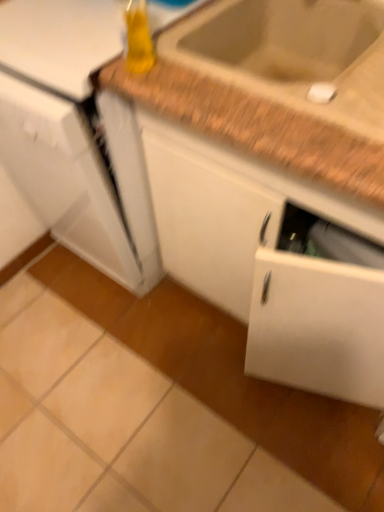
Where is `vacant space to the left of white matte cabinet at center`? vacant space to the left of white matte cabinet at center is located at coordinates (94, 377).